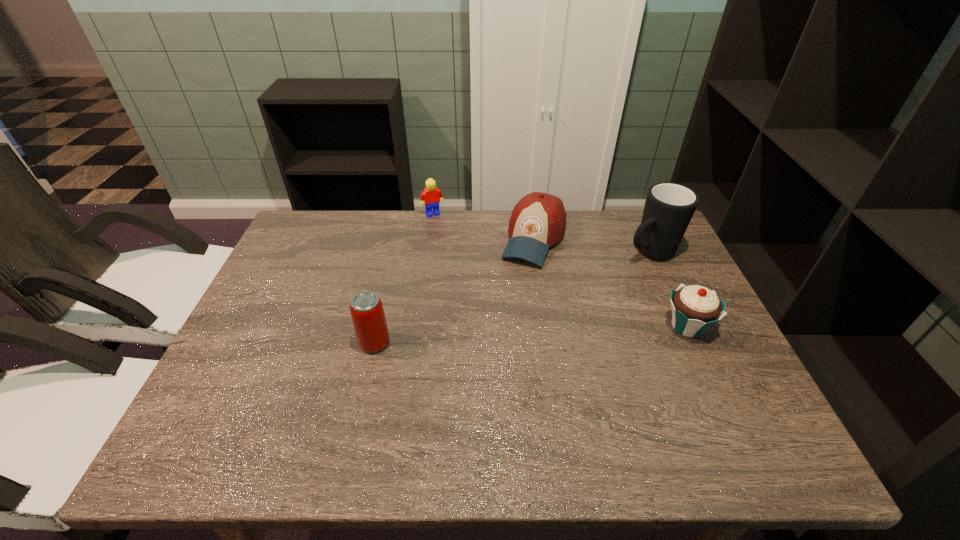
The width and height of the screenshot is (960, 540). Find the location of `the leftmost object`. the leftmost object is located at coordinates (366, 308).

You are a GUI agent. You are given a task and a screenshot of the screen. Output one action in this format:
    pyautogui.click(x=<x>, y=<y>)
    Task: Click on the cupcake
    
    Given the screenshot: What is the action you would take?
    pos(695,308)

Image resolution: width=960 pixels, height=540 pixels. Find the location of `the third object from left to right`. the third object from left to right is located at coordinates (538, 221).

Where is `the fourth object from right to left`? the fourth object from right to left is located at coordinates (432, 196).

You are a GUI agent. You are given a task and a screenshot of the screen. Output one action in this format:
    pyautogui.click(x=<x>, y=<y>)
    Task: Click on the tallest object
    
    Given the screenshot: What is the action you would take?
    pyautogui.click(x=669, y=207)

Identify the location of vacant region located 0.080m on the front of the leftmost object. The image size is (960, 540). (366, 384).

Locate an element on the screen. The image size is (960, 540). blank space located 0.200m on the back of the cupcake is located at coordinates (656, 260).

Locate an element on the screen. This screenshot has height=540, width=960. vacant space located 0.400m on the front-facing side of the baseball cap is located at coordinates (476, 376).

Locate an element on the screen. vacant space located 0.260m on the front-facing side of the baseball cap is located at coordinates (496, 333).

Image resolution: width=960 pixels, height=540 pixels. I want to click on free space located on the front-facing side of the baseball cap, so click(517, 286).